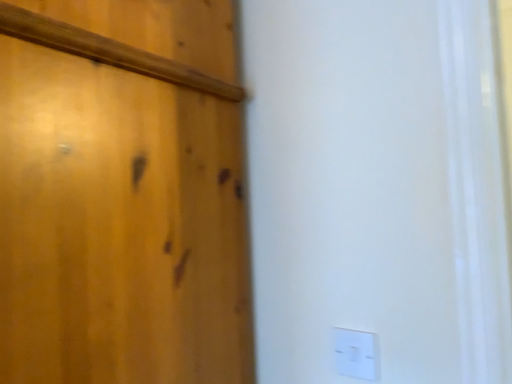
This screenshot has height=384, width=512. What are the coordinates of `wooden door at left` in the screenshot? It's located at (122, 195).

Based on the photo, what is the approximate height of wooden door at left?

The height of wooden door at left is 1.43 meters.

What do you see at coordinates (122, 195) in the screenshot? The width and height of the screenshot is (512, 384). I see `wooden door at left` at bounding box center [122, 195].

Image resolution: width=512 pixels, height=384 pixels. What do you see at coordinates (356, 353) in the screenshot? I see `white plastic light switch at lower right` at bounding box center [356, 353].

Where is `white plastic light switch at lower right`? white plastic light switch at lower right is located at coordinates (356, 353).

Identify the location of wooden door at left. (122, 195).

Between white plastic light switch at lower right and wooden door at left, which one appears on the right side from the viewer's perspective?

white plastic light switch at lower right is more to the right.

Which object is closer to the camera, white plastic light switch at lower right or wooden door at left?

wooden door at left is more forward.

Considering the positions of points (353, 373) and (76, 169), is point (353, 373) farther from camera compared to point (76, 169)?

Yes, point (353, 373) is behind point (76, 169).

From the image's perspective, is white plastic light switch at lower right under wooden door at left?

Correct, white plastic light switch at lower right appears lower than wooden door at left in the image.

From a real-world perspective, is white plastic light switch at lower right positioned above or below wooden door at left?

Clearly, from a real-world perspective, white plastic light switch at lower right is below wooden door at left.

From the picture: Does white plastic light switch at lower right have a lesser width compared to wooden door at left?

Correct, the width of white plastic light switch at lower right is less than that of wooden door at left.

Does white plastic light switch at lower right have a lesser height compared to wooden door at left?

Indeed, white plastic light switch at lower right has a lesser height compared to wooden door at left.

Who is bigger, white plastic light switch at lower right or wooden door at left?

wooden door at left is bigger.

Is white plastic light switch at lower right not inside wooden door at left?

white plastic light switch at lower right is positioned outside wooden door at left.

Is white plastic light switch at lower right beside wooden door at left?

No, white plastic light switch at lower right is not making contact with wooden door at left.

Could you tell me if white plastic light switch at lower right is turned towards wooden door at left?

No, white plastic light switch at lower right is not turned towards wooden door at left.

Can you tell me how much white plastic light switch at lower right and wooden door at left differ in facing direction?

The facing directions of white plastic light switch at lower right and wooden door at left are 0.633 degrees apart.

How much distance is there between white plastic light switch at lower right and wooden door at left?

white plastic light switch at lower right is 18.78 inches from wooden door at left.

Identify the location of door on the left of white plastic light switch at lower right. (122, 195).

Considering the relative positions of wooden door at left and white plastic light switch at lower right in the image provided, is wooden door at left to the left of white plastic light switch at lower right from the viewer's perspective?

Yes, wooden door at left is to the left of white plastic light switch at lower right.

Is wooden door at left in front of white plastic light switch at lower right?

Yes, wooden door at left is in front of white plastic light switch at lower right.

Is point (154, 60) farther from camera compared to point (364, 339)?

No, (154, 60) is in front of (364, 339).

Consider the image. From the image's perspective, which object appears higher, wooden door at left or white plastic light switch at lower right?

wooden door at left.

From a real-world perspective, does wooden door at left sit lower than white plastic light switch at lower right?

No.

Looking at this image, is wooden door at left wider than white plastic light switch at lower right?

Yes, wooden door at left is wider than white plastic light switch at lower right.

Is wooden door at left taller than white plastic light switch at lower right?

Yes, wooden door at left is taller than white plastic light switch at lower right.

Looking at the image, does wooden door at left seem bigger or smaller compared to white plastic light switch at lower right?

wooden door at left is bigger than white plastic light switch at lower right.

Is wooden door at left completely or partially outside of white plastic light switch at lower right?

Yes.

Are wooden door at left and white plastic light switch at lower right located far from each other?

No, wooden door at left is in close proximity to white plastic light switch at lower right.

Does wooden door at left turn towards white plastic light switch at lower right?

No.

How different are the orientations of wooden door at left and white plastic light switch at lower right in degrees?

0.633 degrees.

Where is `light switch located underneath the wooden door at left (from a real-world perspective)`? This screenshot has width=512, height=384. light switch located underneath the wooden door at left (from a real-world perspective) is located at coordinates (356, 353).

The image size is (512, 384). What are the coordinates of `light switch behind the wooden door at left` in the screenshot? It's located at (356, 353).

Where is `light switch that appears below the wooden door at left (from the image's perspective)`? Image resolution: width=512 pixels, height=384 pixels. light switch that appears below the wooden door at left (from the image's perspective) is located at coordinates (356, 353).